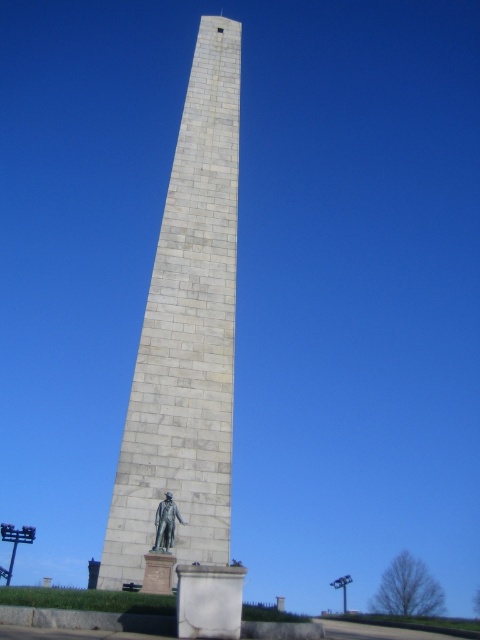
Does white stone obelisk at center have a smaller size compared to bronze statue at lower center?

No, white stone obelisk at center is not smaller than bronze statue at lower center.

Does point (153, 312) come farther from viewer compared to point (171, 500)?

Yes, point (153, 312) is behind point (171, 500).

Is point (162, 268) more distant than point (156, 516)?

Yes, it is.

This screenshot has height=640, width=480. I want to click on white stone obelisk at center, so click(187, 336).